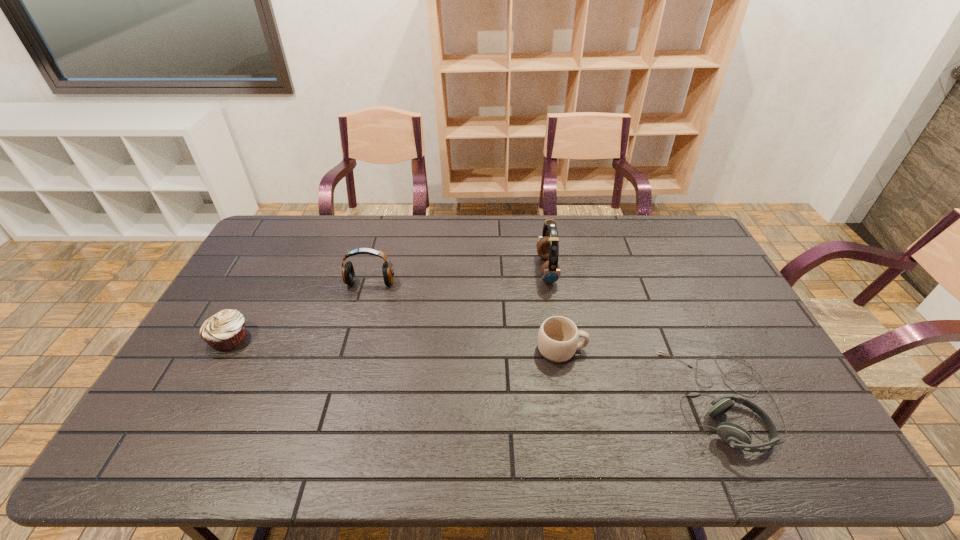
Where is `object positioned at the right edge`? The width and height of the screenshot is (960, 540). object positioned at the right edge is located at coordinates (737, 437).

This screenshot has width=960, height=540. I want to click on object that is at the near right corner, so pos(737,437).

At what (x,y) coordinates should I click in order to perform the action: click on vacant area at the far edge. Please return your answer as a coordinate pair (x, y). Looking at the image, I should click on (329, 220).

Find the location of `free point at the near edge`. free point at the near edge is located at coordinates [x=228, y=437].

Identify the location of vacant space at the left edge of the desktop. (246, 285).

Find the location of `blank space at the right edge of the desktop`. blank space at the right edge of the desktop is located at coordinates (765, 375).

Locate an element on the screen. This screenshot has width=960, height=540. vacant area at the far left corner of the desktop is located at coordinates (293, 233).

Where is `free point at the near left corner`? This screenshot has height=540, width=960. free point at the near left corner is located at coordinates (151, 460).

This screenshot has height=540, width=960. What are the coordinates of `vacant position at the far right corner of the desktop` in the screenshot? It's located at (688, 248).

Where is `free space between the muffin and the second shortest headset`? The image size is (960, 540). free space between the muffin and the second shortest headset is located at coordinates (300, 310).